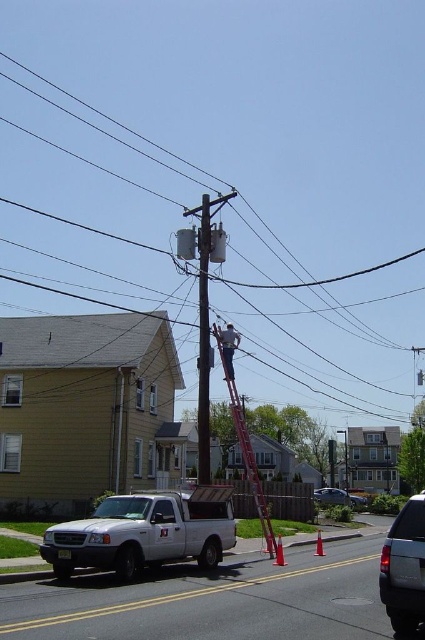
Question: Does smooth gray pole at center appear on the right side of red metallic ladder at center?

Choices:
 (A) yes
 (B) no

Answer: (B)

Question: Which of the following is the closest to the observer?

Choices:
 (A) metallic pole at center
 (B) red metallic ladder at center
 (C) silver metallic sedan at center

Answer: (B)

Question: Which object is farther from the camera taking this photo?

Choices:
 (A) brown wooden telegraph pole at center
 (B) smooth gray pole at center

Answer: (A)

Question: Is white matte truck at lower left thinner than brown wooden telegraph pole at center?

Choices:
 (A) yes
 (B) no

Answer: (A)

Question: Is smooth gray pole at center bigger than metallic silver ladder at center?

Choices:
 (A) yes
 (B) no

Answer: (A)

Question: Which of the following is the farthest from the observer?

Choices:
 (A) metallic pole at center
 (B) silver metallic sedan at center
 (C) smooth gray pole at center

Answer: (B)